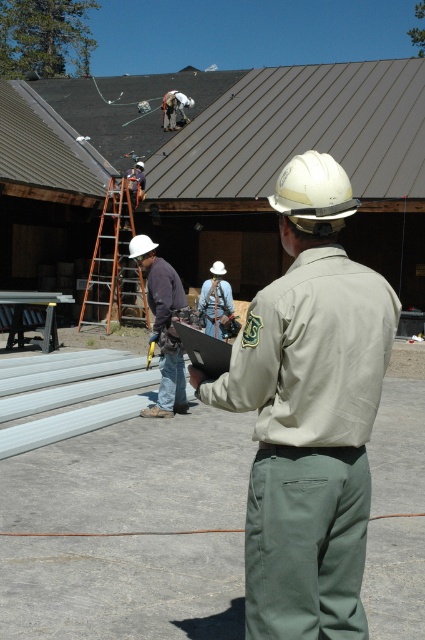
Does metallic gray roof at upper center appear over blue denim shirt at center?

Yes.

Between point (96, 170) and point (204, 310), which one is positioned in front?

Point (204, 310) is more forward.

I want to click on metallic gray roof at upper center, so click(x=226, y=129).

Can you confirm if metallic gray roof at upper center is positioned above wooden at left?

Correct, metallic gray roof at upper center is located above wooden at left.

Image resolution: width=425 pixels, height=640 pixels. What do you see at coordinates (226, 129) in the screenshot? I see `metallic gray roof at upper center` at bounding box center [226, 129].

I want to click on metallic gray roof at upper center, so 226,129.

Is wooden at left positioned behind brushed metal tool at center?

Yes, wooden at left is behind brushed metal tool at center.

Is wooden at left taller than brushed metal tool at center?

Yes.

Is point (102, 232) closer to viewer compared to point (170, 403)?

No, (102, 232) is further to viewer.

Identify the location of wooden at left. This screenshot has height=640, width=425. (115, 264).